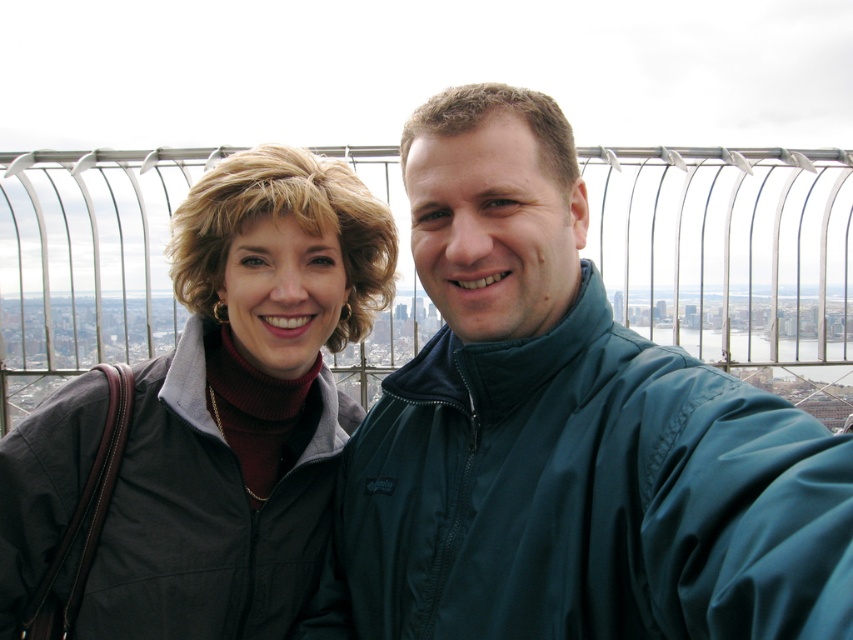
Question: Which object appears closest to the camera in this image?

Choices:
 (A) teal matte jacket at center
 (B) matte black jacket at left

Answer: (A)

Question: Does teal matte jacket at center appear over matte black jacket at left?

Choices:
 (A) no
 (B) yes

Answer: (B)

Question: Does teal matte jacket at center have a smaller size compared to matte black jacket at left?

Choices:
 (A) yes
 (B) no

Answer: (B)

Question: Is teal matte jacket at center positioned at the back of matte black jacket at left?

Choices:
 (A) no
 (B) yes

Answer: (A)